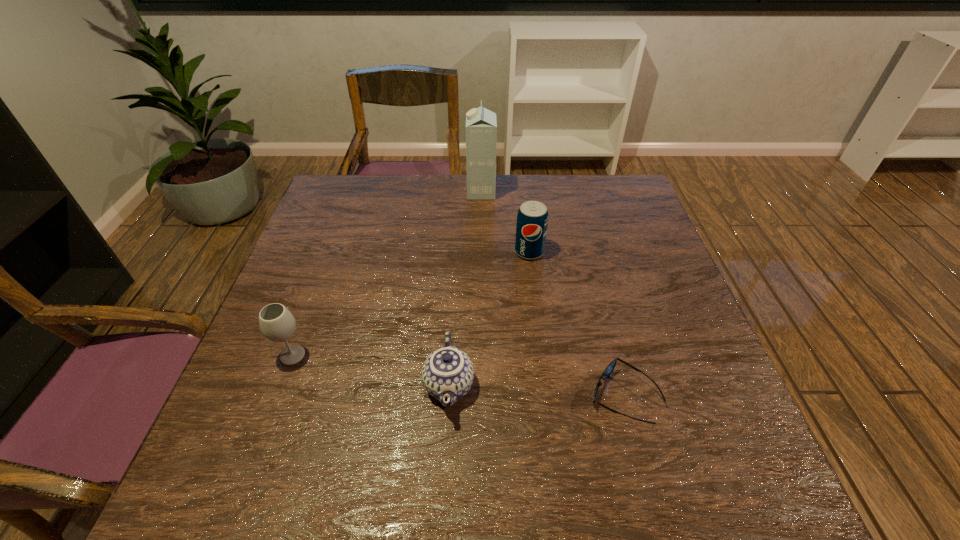
The image size is (960, 540). I want to click on vacant space that satisfies the following two spatial constraints: 1. on the front label of the tallest object; 2. from the spout of the second shortest object, so click(x=482, y=385).

I want to click on vacant space that satisfies the following two spatial constraints: 1. on the front label of the carton; 2. from the spout of the chinaware, so click(482, 385).